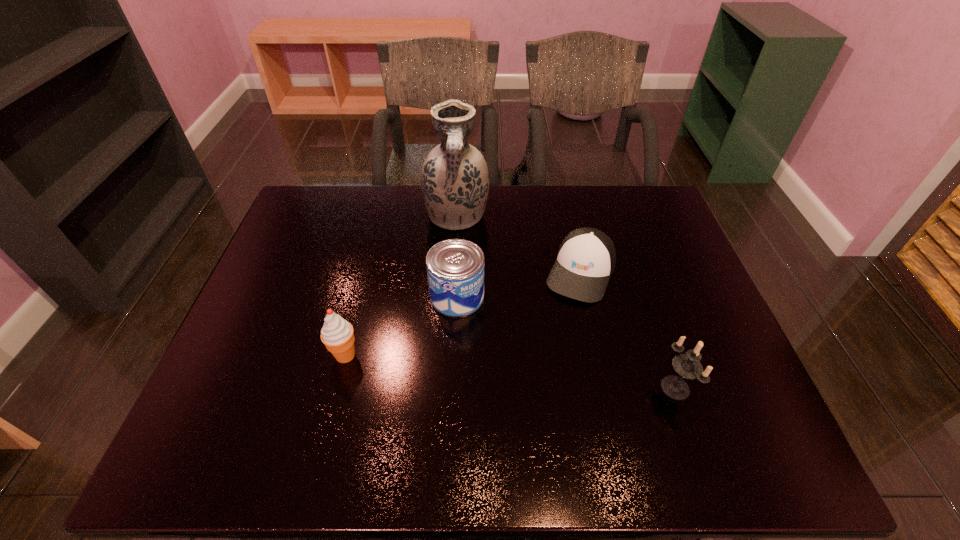
Locate an element on the screen. icecream is located at coordinates (337, 334).

This screenshot has height=540, width=960. Identify the location of the second nearest object. (337, 334).

The image size is (960, 540). Find the location of `the nearest object`. the nearest object is located at coordinates point(688,366).

At what (x,y) coordinates should I click in order to perform the action: click on candle holder. Please return your answer as a coordinate pair (x, y). This screenshot has width=960, height=540. Looking at the image, I should click on (688, 366).

This screenshot has width=960, height=540. In order to click on the shortest object in this screenshot , I will do `click(586, 258)`.

Locate an element on the screen. This screenshot has height=540, width=960. cap is located at coordinates (586, 258).

At what (x,y) coordinates should I click in order to perform the action: click on the tallest object. Please return your answer as a coordinate pair (x, y). Looking at the image, I should click on (455, 181).

The image size is (960, 540). In order to click on the farthest object in this screenshot , I will do `click(455, 181)`.

The width and height of the screenshot is (960, 540). What are the coordinates of `the second shortest object` in the screenshot? It's located at point(455,267).

You are a GUI agent. You are given a task and a screenshot of the screen. Output one action in this format:
    pyautogui.click(x=<x>, y=<y>)
    Task: Click on the vacant space located on the left of the icecream
    
    Given the screenshot: What is the action you would take?
    pyautogui.click(x=309, y=355)